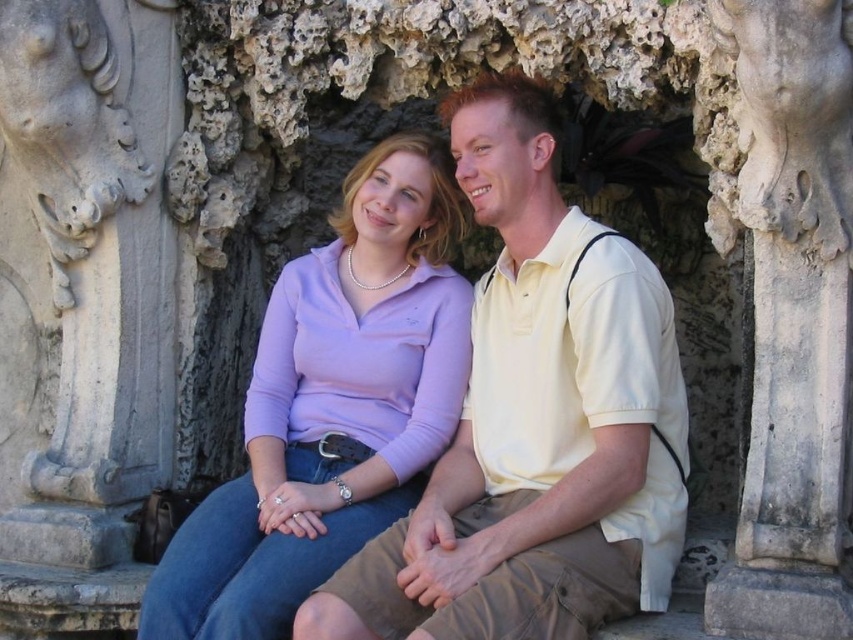
Question: Which point is farther to the camera?

Choices:
 (A) (415, 413)
 (B) (628, 532)
 (C) (782, 96)

Answer: (A)

Question: Which of these objects is positioned farthest from the white stone carving at center?

Choices:
 (A) matte purple shirt at center
 (B) matte yellow shirt at center

Answer: (A)

Question: Is matte yellow shirt at center bigger than white stone carving at center?

Choices:
 (A) yes
 (B) no

Answer: (A)

Question: Which point is closer to the camera?

Choices:
 (A) (294, 593)
 (B) (825, 428)
 (C) (555, 332)

Answer: (B)

Question: Is matte purple shirt at center to the right of white stone carving at center from the viewer's perspective?

Choices:
 (A) no
 (B) yes

Answer: (A)

Question: Is matte purple shirt at center positioned at the back of white stone carving at center?

Choices:
 (A) yes
 (B) no

Answer: (A)